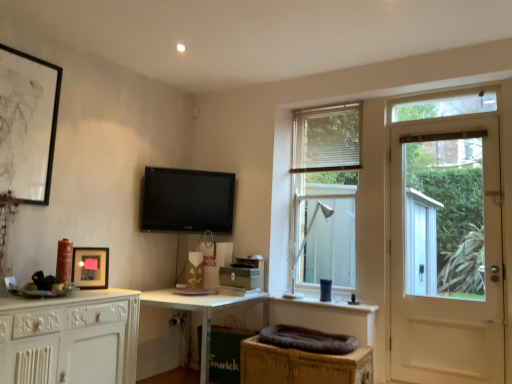
Question: Can you confirm if matte black picture frame at left, marked as the 1th picture frame in a right-to-left arrangement, is positioned to the right of white metal table lamp at center?

Choices:
 (A) yes
 (B) no

Answer: (B)

Question: From the image's perspective, is matte black picture frame at left, the 2th picture frame viewed from the left, under white metal table lamp at center?

Choices:
 (A) no
 (B) yes

Answer: (B)

Question: Are matte black picture frame at left, the 2th picture frame viewed from the left, and white metal table lamp at center located far from each other?

Choices:
 (A) no
 (B) yes

Answer: (B)

Question: From the image's perspective, is matte black picture frame at left, the 2th picture frame viewed from the left, located above white metal table lamp at center?

Choices:
 (A) no
 (B) yes

Answer: (A)

Question: Is matte black picture frame at left, the second picture frame positioned from the top, touching white metal table lamp at center?

Choices:
 (A) no
 (B) yes

Answer: (A)

Question: Is brown wicker basket at lower center, which is the 1th cabinetry from right to left, in front of or behind matte black picture frame at left, marked as the 1th picture frame in a right-to-left arrangement, in the image?

Choices:
 (A) behind
 (B) front

Answer: (B)

Question: From a real-world perspective, is brown wicker basket at lower center, marked as the second cabinetry in a left-to-right arrangement, above or below matte black picture frame at left, the first picture frame from the bottom?

Choices:
 (A) below
 (B) above

Answer: (A)

Question: Is brown wicker basket at lower center, which is the 1th cabinetry from right to left, taller or shorter than matte black picture frame at left, the first picture frame from the bottom?

Choices:
 (A) tall
 (B) short

Answer: (A)

Question: Visually, is brown wicker basket at lower center, which is the 1th cabinetry from right to left, positioned to the left or to the right of matte black picture frame at left, the second picture frame positioned from the top?

Choices:
 (A) right
 (B) left

Answer: (A)

Question: Is white metal table lamp at center in front of or behind white wooden door at right in the image?

Choices:
 (A) front
 (B) behind

Answer: (B)

Question: In terms of width, does white metal table lamp at center look wider or thinner when compared to white wooden door at right?

Choices:
 (A) thin
 (B) wide

Answer: (B)

Question: Is white metal table lamp at center bigger or smaller than white wooden door at right?

Choices:
 (A) big
 (B) small

Answer: (B)

Question: In the image, is white metal table lamp at center on the left side or the right side of white wooden door at right?

Choices:
 (A) right
 (B) left

Answer: (B)

Question: Is white wooden door at right bigger or smaller than white metal table lamp at center?

Choices:
 (A) big
 (B) small

Answer: (A)

Question: Based on their positions, is white wooden door at right located to the left or right of white metal table lamp at center?

Choices:
 (A) left
 (B) right

Answer: (B)